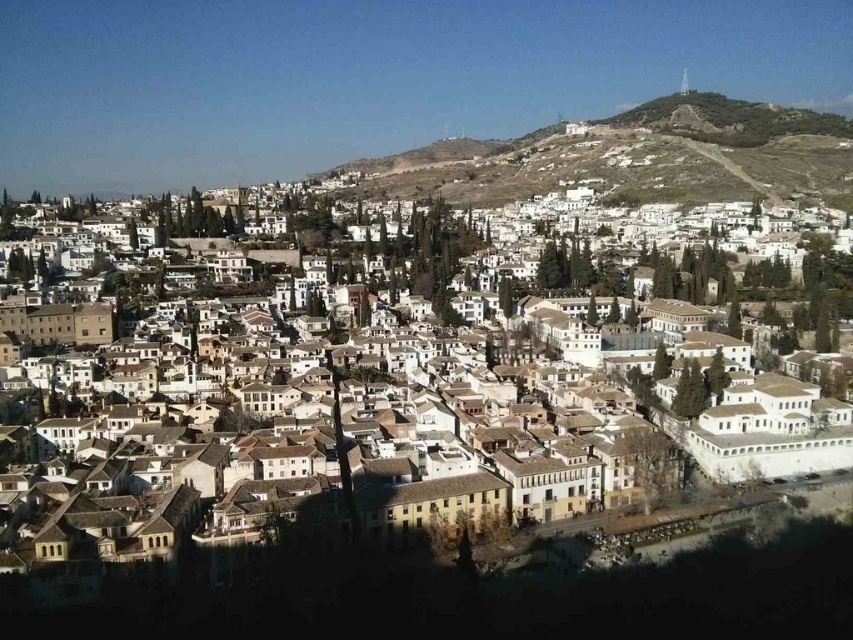
Between point (463, 483) and point (598, 131), which one is positioned in front?

Point (463, 483) is in front.

Between point (445, 365) and point (779, 134), which one is positioned behind?

Positioned behind is point (779, 134).

The width and height of the screenshot is (853, 640). In order to click on white matte buildings at center in this screenshot , I will do `click(461, 419)`.